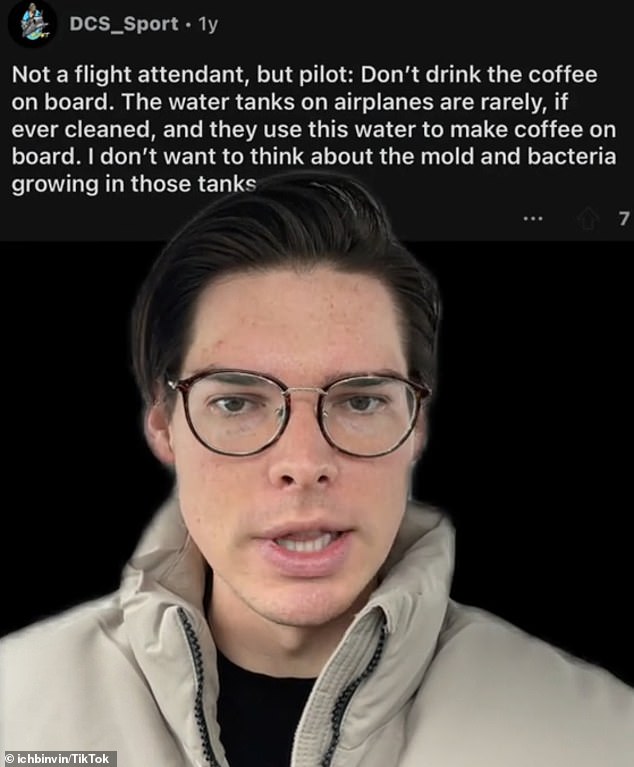
Locate an element on the screen. This screenshot has height=767, width=634. coat is located at coordinates (470, 662).